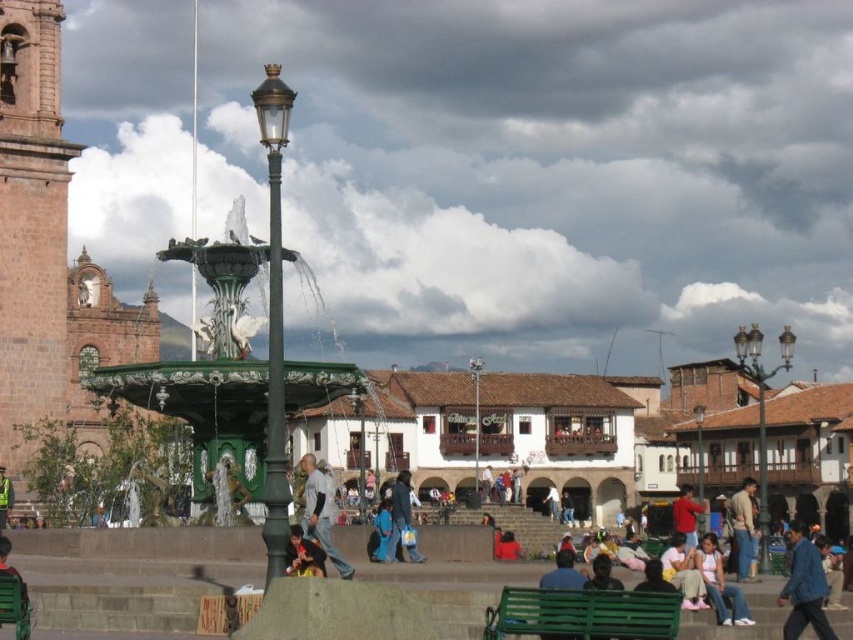
You are a photographer positioned at the edge of the square. You want to capture both the dark gray jeans at center and the red cotton shirt at lower right in the same frame. Which object should you focus on first to ensure both are in the shot?

The dark gray jeans at center has a lesser width compared to red cotton shirt at lower right, so you should focus on the red cotton shirt at lower right first to ensure both are in the shot since it takes up more space and will help frame the composition better.

You are a photographer positioned at the edge of the square and want to capture both the dark gray jeans at center and the red cotton shirt at lower right in the same frame. Which object should you focus on first to ensure both are in focus?

You should focus on the dark gray jeans at center first since it is in front of the red cotton shirt at lower right, so adjusting focus starting from the closer object will help both be in focus.